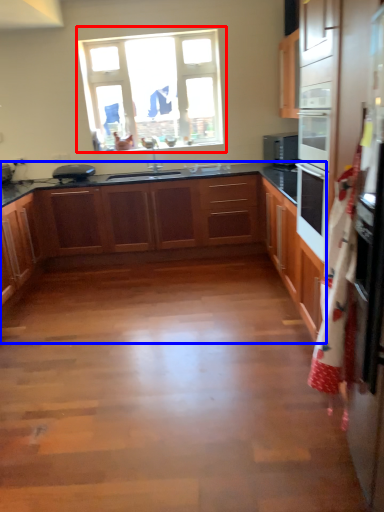
Question: Among these objects, which one is farthest to the camera, window (highlighted by a red box) or cabinetry (highlighted by a blue box)?

Choices:
 (A) window
 (B) cabinetry

Answer: (A)